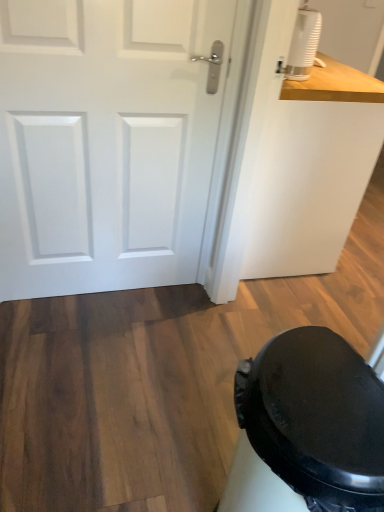
I want to click on free spot above black matte potty at lower right (from a real-world perspective), so click(325, 391).